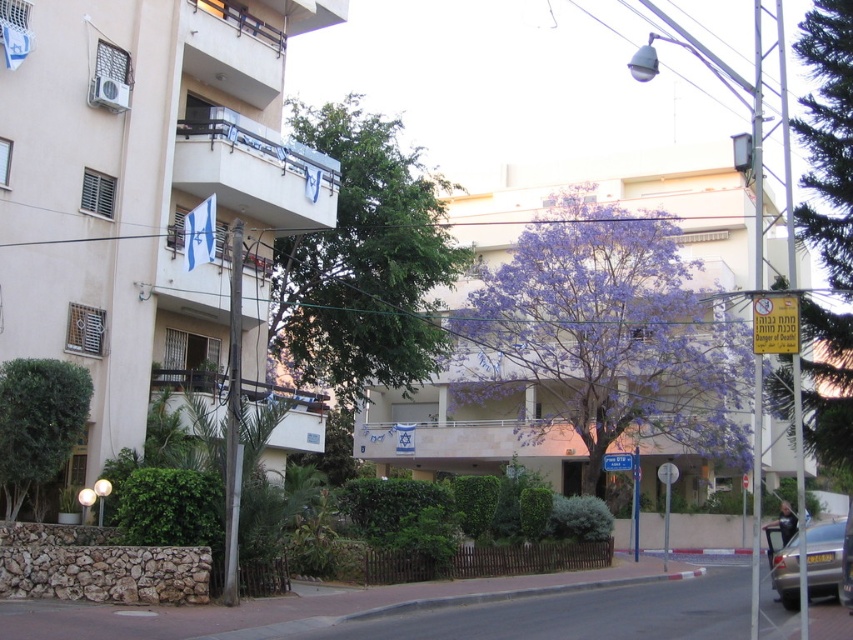
Does green leafy tree at center have a greater width compared to silver metallic car at lower right?

Yes.

Image resolution: width=853 pixels, height=640 pixels. I want to click on green leafy tree at center, so click(x=363, y=262).

Identify the location of green leafy tree at center. (363, 262).

From the picture: Between green leafy bush at lower left and silver metallic car at lower right, which one appears on the right side from the viewer's perspective?

silver metallic car at lower right is more to the right.

Who is higher up, green leafy bush at lower left or silver metallic car at lower right?

green leafy bush at lower left

Is point (78, 435) positioned behind point (781, 550)?

Yes, it is behind point (781, 550).

The width and height of the screenshot is (853, 640). I want to click on green leafy bush at lower left, so click(x=38, y=422).

Between purple leafy tree at upper right and silver metallic car at lower right, which one appears on the left side from the viewer's perspective?

From the viewer's perspective, silver metallic car at lower right appears more on the left side.

Is point (824, 440) positioned before point (817, 554)?

Yes.

Locate an element on the screen. The width and height of the screenshot is (853, 640). purple leafy tree at upper right is located at coordinates (827, 138).